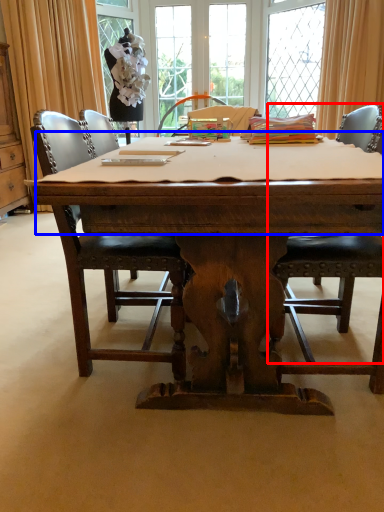
Question: Which point is further to the camera, chair (highlighted by a red box) or tablecloth (highlighted by a blue box)?

Choices:
 (A) chair
 (B) tablecloth

Answer: (A)